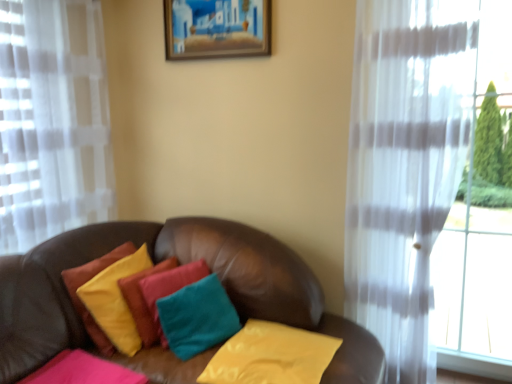
Question: From the image's perspective, is teal fabric pillow at center, the 2th pillow from the right, above or below wooden picture frame at upper center?

Choices:
 (A) below
 (B) above

Answer: (A)

Question: Visually, is teal fabric pillow at center, the 2th pillow from the right, positioned to the left or to the right of wooden picture frame at upper center?

Choices:
 (A) left
 (B) right

Answer: (A)

Question: Based on their relative distances, which object is nearer to the velvet yellow pillow at center, which is counted as the 2th pillow, starting from the left?

Choices:
 (A) pink velvety pillow at lower left, acting as the 4th pillow starting from the right
 (B) teal fabric pillow at center, the 2th pillow from the right
 (C) yellow fabric pillow at center, which is the first pillow in right-to-left order
 (D) wooden picture frame at upper center

Answer: (A)

Question: Estimate the real-world distances between objects in this image. Which object is farther from the pink velvety pillow at lower left, acting as the 4th pillow starting from the right?

Choices:
 (A) velvet yellow pillow at center, the third pillow from the right
 (B) yellow fabric pillow at center, the 4th pillow positioned from the left
 (C) teal fabric pillow at center, which is the 3th pillow in left-to-right order
 (D) wooden picture frame at upper center

Answer: (D)